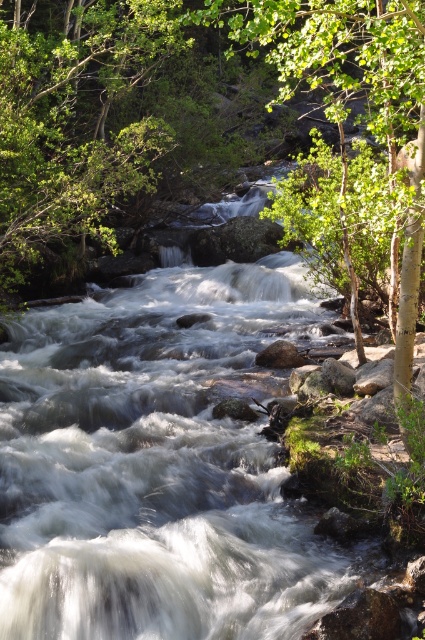
Question: Which of the following is the farthest from the observer?

Choices:
 (A) green leafy tree at upper left
 (B) green leafy tree at center

Answer: (A)

Question: Which point appears farthest from the camera in this image?

Choices:
 (A) (416, 22)
 (B) (28, 268)

Answer: (B)

Question: Does green leafy tree at upper left have a larger size compared to green leafy tree at center?

Choices:
 (A) yes
 (B) no

Answer: (B)

Question: From the image, what is the correct spatial relationship of green leafy tree at upper left in relation to green leafy tree at center?

Choices:
 (A) above
 (B) below

Answer: (B)

Question: Is green leafy tree at upper left smaller than green leafy tree at center?

Choices:
 (A) no
 (B) yes

Answer: (B)